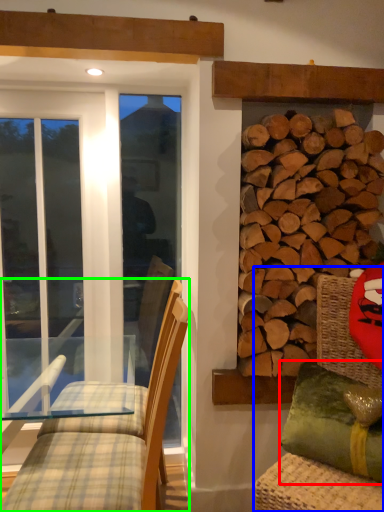
Question: Estimate the real-world distances between objects in this image. Which object is farther from pillow (highlighted by a red box), swivel chair (highlighted by a blue box) or chair (highlighted by a green box)?

Choices:
 (A) swivel chair
 (B) chair

Answer: (B)